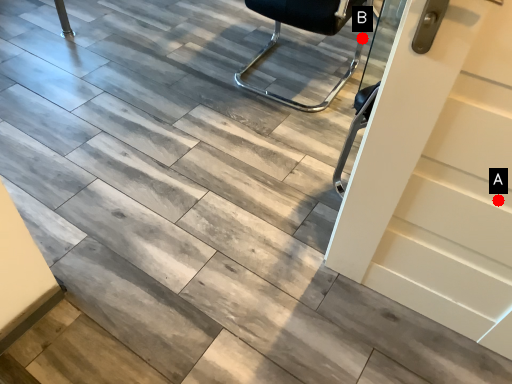
Question: Two points are circled on the image, labeled by A and B beside each circle. Among these points, which one is nearest to the camera?

Choices:
 (A) A is closer
 (B) B is closer

Answer: (A)